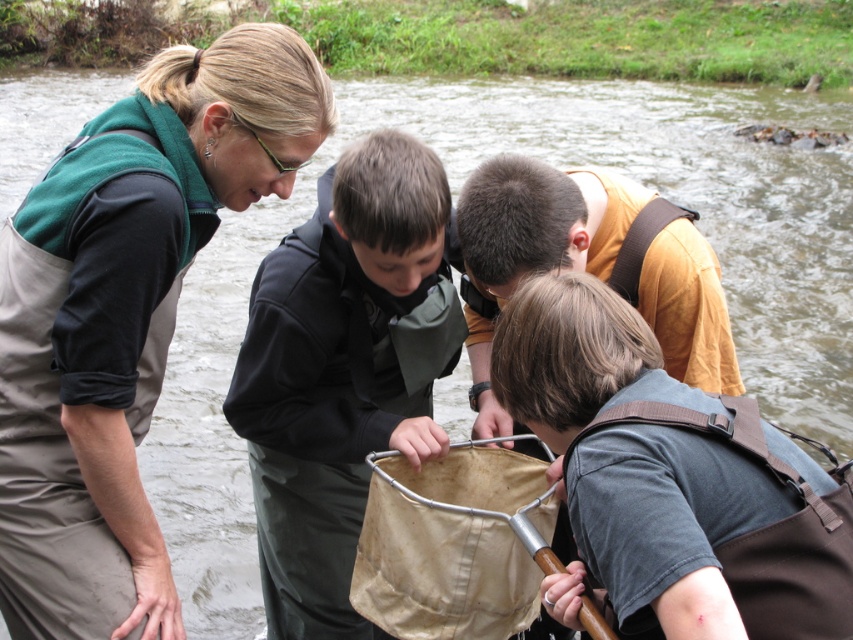
You are a field researcher who needs to store a newly collected water sample in a container. You have the brown fabric backpack at lower right and the orange cotton shirt at center available. Which item can you use to carry the container without it falling out?

The orange cotton shirt at center is larger than the brown fabric backpack at lower right, so the orange cotton shirt at center can hold the container more securely without it falling out.

Based on the photo, you are standing at the center of the image. Which direction should you move to reach the matte gray waders at left?

The matte gray waders at left is located at point 0.495 on the x axis and 0.148 on the y axis. Since you are at the center, you should move to the left and slightly downward to reach it.